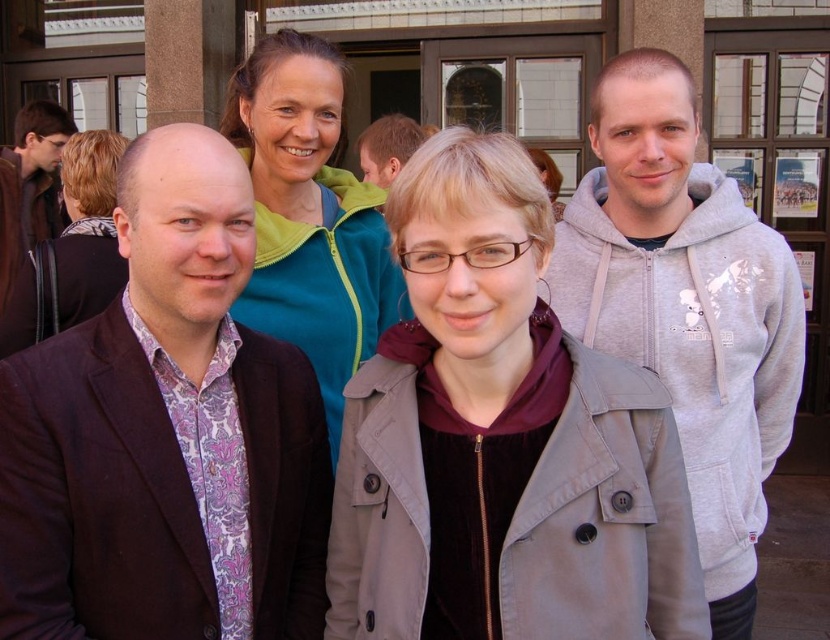
Question: Which point appears farthest from the camera in this image?

Choices:
 (A) (140, 289)
 (B) (28, 218)
 (C) (369, 346)
 (D) (721, 570)

Answer: (B)

Question: Does patterned fabric shirt at center appear under gray hoodie at right?

Choices:
 (A) yes
 (B) no

Answer: (A)

Question: Which point is closer to the camera?

Choices:
 (A) (631, 547)
 (B) (313, 179)

Answer: (A)

Question: Can you confirm if teal fleece jacket at upper center is positioned below light brown hair at center?

Choices:
 (A) no
 (B) yes

Answer: (B)

Question: Is gray hoodie at right behind matte blue jacket at center?

Choices:
 (A) yes
 (B) no

Answer: (B)

Question: Considering the real-world distances, which object is closest to the light gray fabric coat at center?

Choices:
 (A) gray hoodie at right
 (B) matte blue jacket at center

Answer: (A)